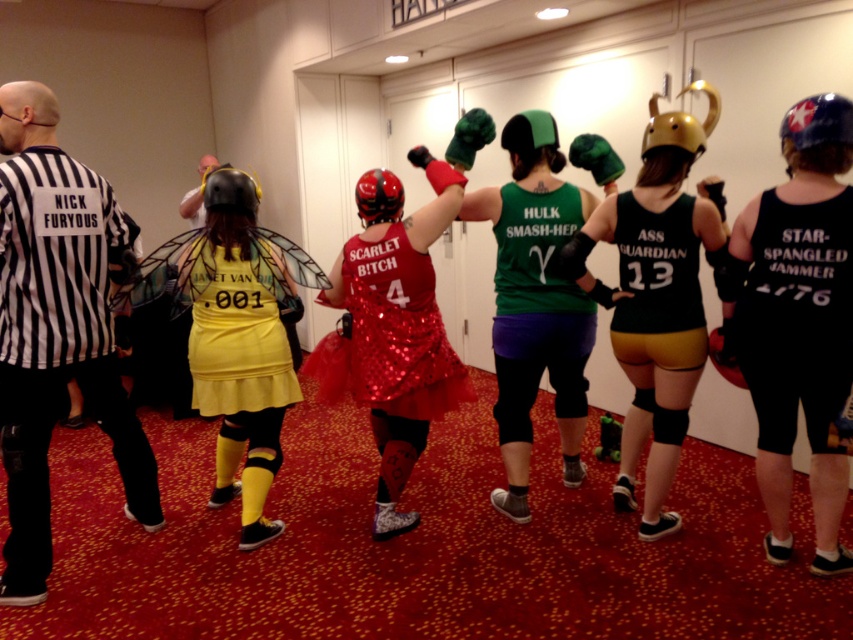
Who is lower down, yellow matte dress at center or green matte helmet at center?

yellow matte dress at center

Is yellow matte dress at center below green matte helmet at center?

Yes.

Who is more forward, (218,225) or (514,164)?

Point (218,225) is in front.

You are a GUI agent. You are given a task and a screenshot of the screen. Output one action in this format:
    pyautogui.click(x=<x>, y=<y>)
    Task: Click on the yellow matte dress at center
    
    Given the screenshot: What is the action you would take?
    pyautogui.click(x=239, y=346)

Measure the distance between black matte helmet at center and camera.

black matte helmet at center and camera are 2.61 meters apart.

Is black matte helmet at center positioned before shiny red helmet at center?

Yes.

The width and height of the screenshot is (853, 640). Describe the element at coordinates (230, 189) in the screenshot. I see `black matte helmet at center` at that location.

At what (x,y) coordinates should I click in order to perform the action: click on black matte helmet at center. Please return your answer as a coordinate pair (x, y). This screenshot has width=853, height=640. Looking at the image, I should click on (230, 189).

Can you confirm if metallic gold helmet at center is shorter than shiny sequined tutu at center?

Incorrect, metallic gold helmet at center's height does not fall short of shiny sequined tutu at center's.

Between point (654, 349) and point (454, 358), which one is positioned behind?

Positioned behind is point (454, 358).

In order to click on metallic gold helmet at center in this screenshot , I will do `click(656, 296)`.